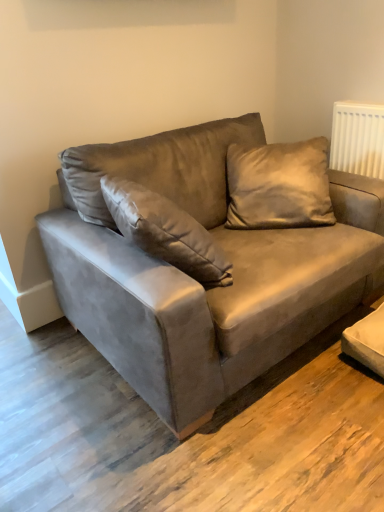
Question: Considering the relative sizes of suede pillow at upper right and suede couch at center in the image provided, is suede pillow at upper right bigger than suede couch at center?

Choices:
 (A) no
 (B) yes

Answer: (A)

Question: Does suede pillow at upper right have a lesser width compared to suede couch at center?

Choices:
 (A) no
 (B) yes

Answer: (B)

Question: From a real-world perspective, is suede pillow at upper right physically above suede couch at center?

Choices:
 (A) yes
 (B) no

Answer: (A)

Question: Is suede pillow at upper right facing towards suede couch at center?

Choices:
 (A) yes
 (B) no

Answer: (A)

Question: Would you say suede pillow at upper right is outside suede couch at center?

Choices:
 (A) no
 (B) yes

Answer: (A)

Question: Is suede pillow at upper right with suede couch at center?

Choices:
 (A) yes
 (B) no

Answer: (B)

Question: Is suede couch at center closer to the viewer compared to suede pillow at upper right?

Choices:
 (A) no
 (B) yes

Answer: (B)

Question: Is suede couch at center not close to suede pillow at upper right?

Choices:
 (A) yes
 (B) no

Answer: (B)

Question: Does suede couch at center appear on the right side of suede pillow at upper right?

Choices:
 (A) no
 (B) yes

Answer: (A)

Question: From a real-world perspective, is suede couch at center over suede pillow at upper right?

Choices:
 (A) yes
 (B) no

Answer: (B)

Question: Is suede couch at center shorter than suede pillow at upper right?

Choices:
 (A) no
 (B) yes

Answer: (A)

Question: Is suede couch at center turned away from suede pillow at upper right?

Choices:
 (A) no
 (B) yes

Answer: (B)

Question: From the image's perspective, relative to suede pillow at upper right, is suede couch at center above or below?

Choices:
 (A) below
 (B) above

Answer: (A)